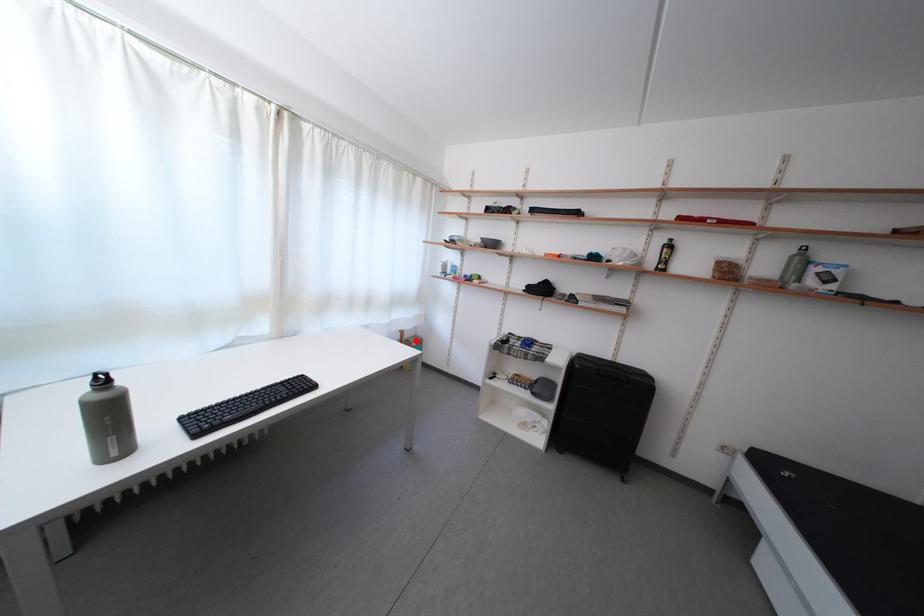
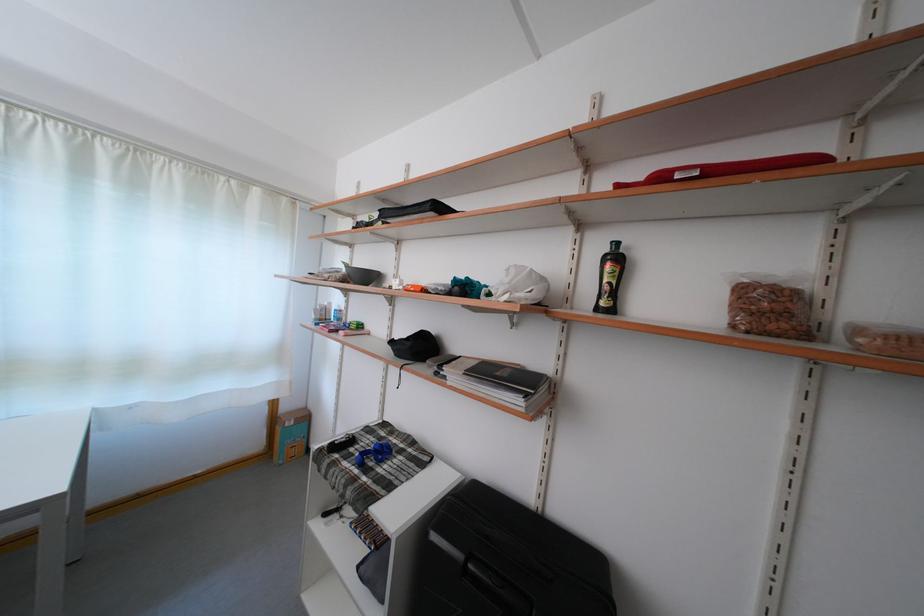
In the second image, find the point that corresponds to the highlighted location in the first image.

(293, 415)